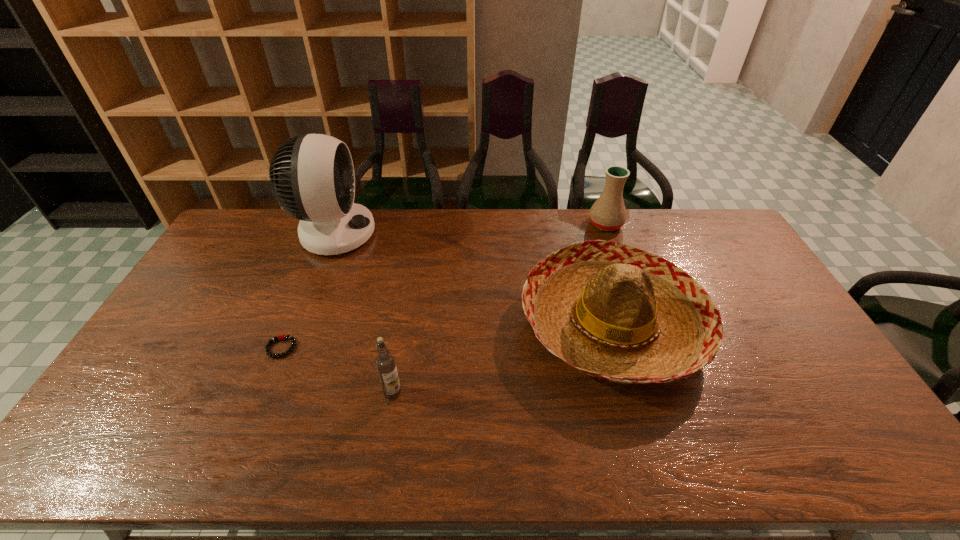
Image resolution: width=960 pixels, height=540 pixels. Find the location of `vacant position in the image that satisfies the following two spatial constraints: 1. on the front side of the pottery; 2. on the grille of the tallest object`. vacant position in the image that satisfies the following two spatial constraints: 1. on the front side of the pottery; 2. on the grille of the tallest object is located at coordinates (609, 233).

The width and height of the screenshot is (960, 540). Identify the location of free point that satisfies the following two spatial constraints: 1. on the grille of the sombrero; 2. on the left side of the tallest object. (299, 323).

The image size is (960, 540). In order to click on free space that satisfies the following two spatial constraints: 1. on the back side of the sombrero; 2. on the grille of the fan in this screenshot , I will do `click(587, 233)`.

The height and width of the screenshot is (540, 960). I want to click on vacant space that satisfies the following two spatial constraints: 1. on the grille of the sombrero; 2. on the left side of the tallest object, so click(299, 323).

You are a GUI agent. You are given a task and a screenshot of the screen. Output one action in this format:
    pyautogui.click(x=<x>, y=<y>)
    Task: Click on the free spot that satisfies the following two spatial constraints: 1. on the back side of the bracelet; 2. on the right side of the sombrero
    
    Given the screenshot: What is the action you would take?
    pyautogui.click(x=291, y=323)